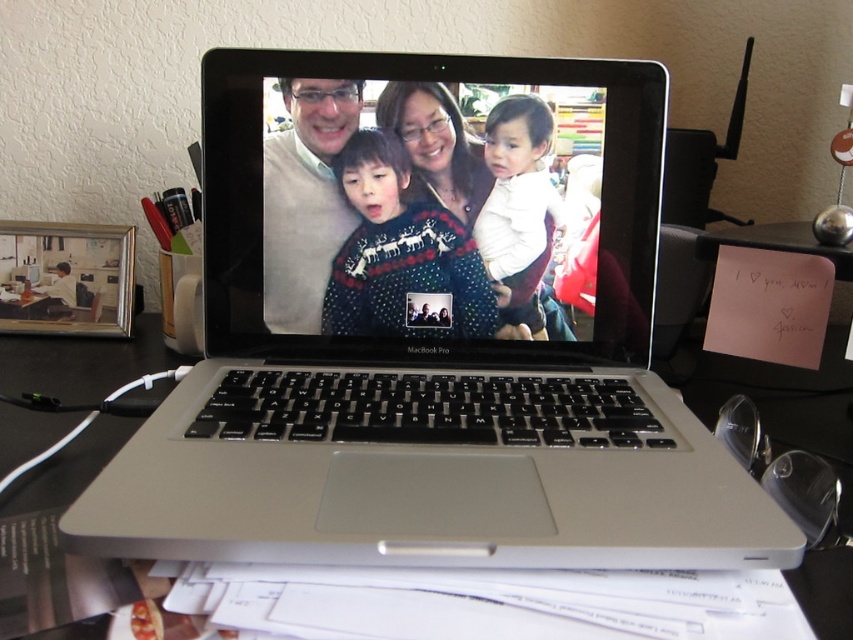
You are organizing a small dinner party and need to place a rectangular tablecloth on the black plastic table at center. The tablecloth you have is the size of the white soft fabric at center. Will the tablecloth fit over the entire table?

The black plastic table at center might be wider than white soft fabric at center, so there is a possibility that the tablecloth may not fully cover the table, leaving some areas exposed.

You are trying to locate the point with coordinates [428,332] on the MacBook Pro laptop at center. Based on the scene description, where would this point be located on the silver metallic laptop at center?

The point with coordinates [428,332] is located on the silver metallic laptop at center.